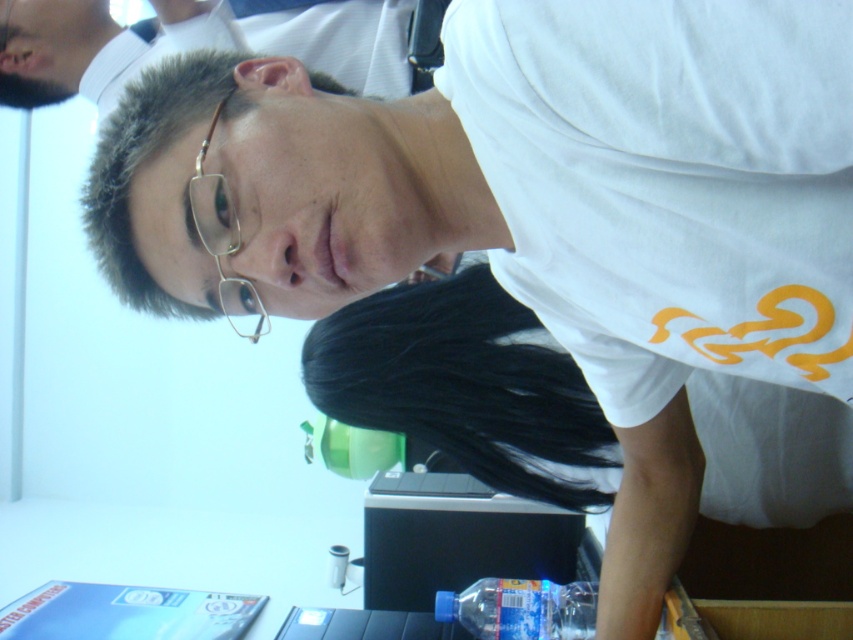
Question: Does matte white shirt at upper center have a larger size compared to gold metallic glasses at upper center?

Choices:
 (A) yes
 (B) no

Answer: (A)

Question: Can you confirm if matte white shirt at upper center is thinner than black plastic table at lower center?

Choices:
 (A) yes
 (B) no

Answer: (B)

Question: Which point is closer to the camera taking this photo?

Choices:
 (A) (375, 20)
 (B) (534, 628)
 (C) (343, 547)

Answer: (B)

Question: Which point is closer to the camera taking this photo?

Choices:
 (A) (683, 598)
 (B) (219, 282)
 (C) (135, 72)

Answer: (B)

Question: Is matte white shirt at upper center behind blue plastic bottle at lower center?

Choices:
 (A) yes
 (B) no

Answer: (A)

Question: Which object is the closest to the blue plastic bottle at lower center?

Choices:
 (A) gold metallic glasses at upper center
 (B) black plastic table at lower center

Answer: (A)